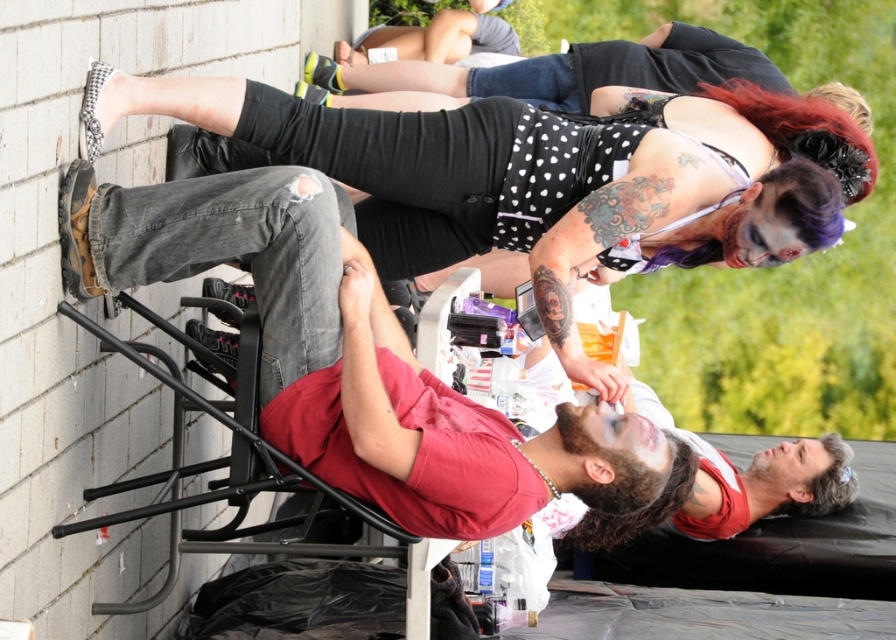
Who is positioned more to the right, polka dot fabric dress at upper center or matte red shirt at center?

polka dot fabric dress at upper center

Does point (85, 104) come closer to viewer compared to point (414, 493)?

No.

Where is `polka dot fabric dress at upper center`? This screenshot has width=896, height=640. polka dot fabric dress at upper center is located at coordinates click(x=538, y=179).